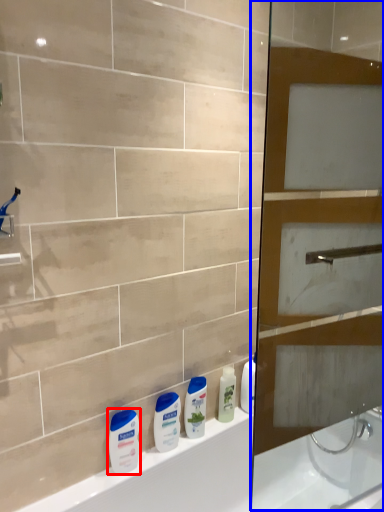
Question: Among these objects, which one is nearest to the camera, toiletry (highlighted by a red box) or screen door (highlighted by a blue box)?

Choices:
 (A) toiletry
 (B) screen door

Answer: (B)